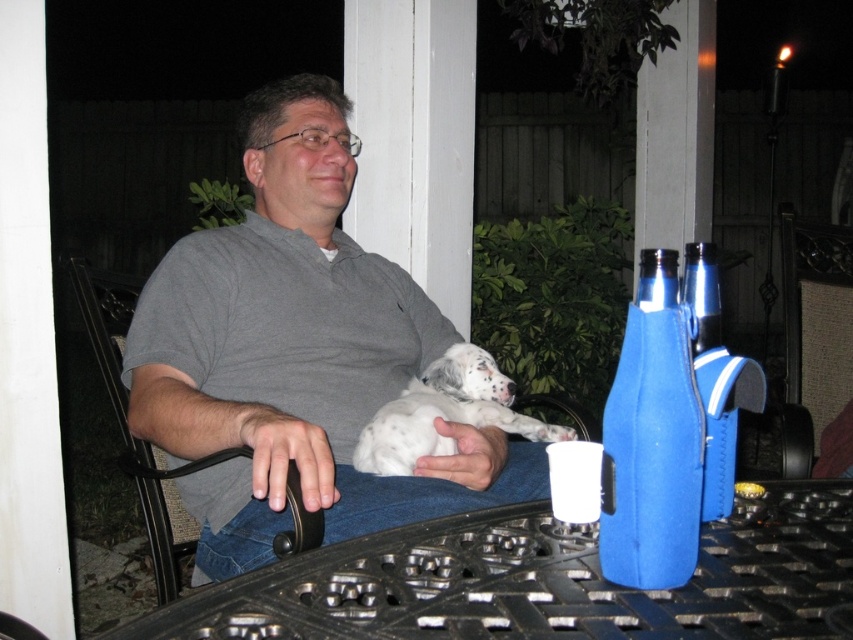
Can you confirm if metallic black table at lower center is shorter than black plastic chair at lower right?

Yes.

Based on the photo, is the position of metallic black table at lower center less distant than that of black plastic chair at lower right?

That is True.

Between point (828, 563) and point (802, 221), which one is positioned in front?

Point (828, 563)

Find the location of `metallic black table at lower center`. metallic black table at lower center is located at coordinates click(x=543, y=580).

Does black plastic chair at lower right appear over shiny metallic bottle at right?

No.

Who is more forward, (805, 248) or (718, 276)?

Point (805, 248) is more forward.

Who is more forward, (816, 282) or (711, 346)?

Point (711, 346) is in front.

Where is `black plastic chair at lower right`? The width and height of the screenshot is (853, 640). black plastic chair at lower right is located at coordinates coord(816,344).

Is gray cotton shirt at center further to the viewer compared to black plastic chair at lower right?

No, gray cotton shirt at center is closer to the viewer.

Based on the photo, between gray cotton shirt at center and black plastic chair at lower right, which one is positioned higher?

Positioned higher is gray cotton shirt at center.

Between point (285, 392) and point (795, 374), which one is positioned behind?

The point (795, 374) is more distant.

Find the location of a particular element. The height and width of the screenshot is (640, 853). gray cotton shirt at center is located at coordinates (297, 353).